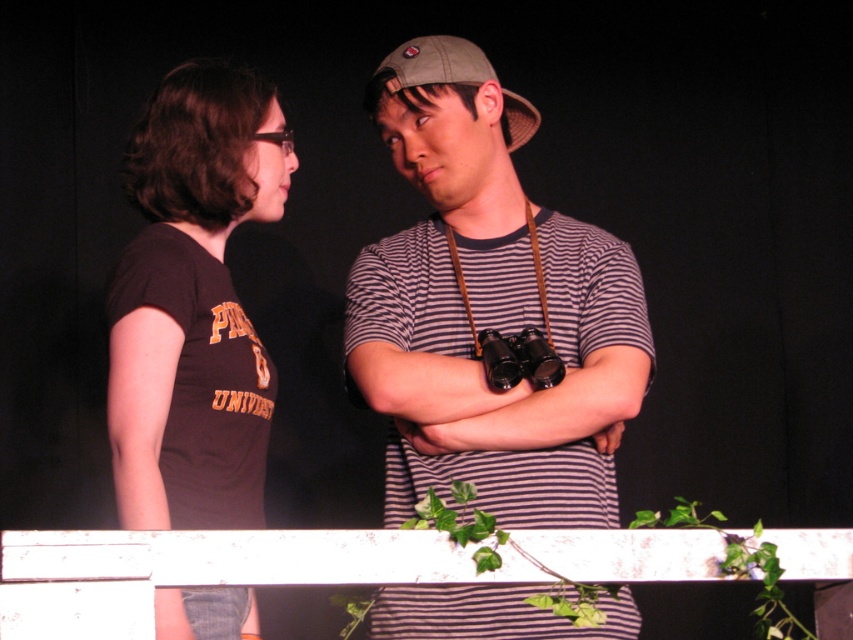
Can you confirm if white painted wood at center is shorter than khaki fabric baseball cap at center?

Indeed, white painted wood at center has a lesser height compared to khaki fabric baseball cap at center.

Which of these two, white painted wood at center or khaki fabric baseball cap at center, stands taller?

khaki fabric baseball cap at center is taller.

Locate an element on the screen. white painted wood at center is located at coordinates (207, 570).

Is brown cotton t-shirt at left positioned in front of white painted wood at center?

No, brown cotton t-shirt at left is further to the viewer.

In the scene shown: Which is below, brown cotton t-shirt at left or white painted wood at center?

white painted wood at center is lower down.

Is point (144, 490) more distant than point (155, 576)?

Yes, point (144, 490) is farther from viewer.

Find the location of `brown cotton t-shirt at left`. brown cotton t-shirt at left is located at coordinates (193, 305).

Between point (279, 216) and point (389, 90), which one is positioned in front?

Positioned in front is point (389, 90).

Does brown cotton t-shirt at left have a lesser width compared to khaki fabric baseball cap at center?

In fact, brown cotton t-shirt at left might be wider than khaki fabric baseball cap at center.

Is point (219, 476) positioned behind point (520, 108)?

That is False.

Where is `brown cotton t-shirt at left`? This screenshot has width=853, height=640. brown cotton t-shirt at left is located at coordinates (193, 305).